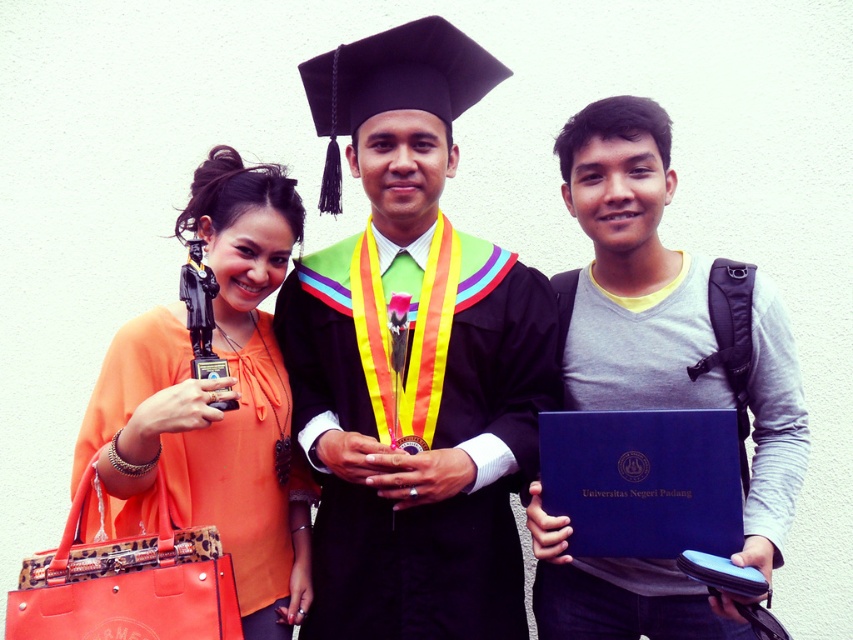
Does point (469, 564) come in front of point (299, 580)?

That is True.

Measure the distance between point [387,557] and camera.

They are 2.17 meters apart.

Find the location of `matte black graduation gown at center`. matte black graduation gown at center is located at coordinates (413, 358).

Does gray matte backpack at center have a smaller size compared to orange fabric purse at left?

No.

Which is behind, point (659, 381) or point (119, 333)?

Positioned behind is point (659, 381).

This screenshot has width=853, height=640. What are the coordinates of `gray matte backpack at center` in the screenshot? It's located at (631, 272).

This screenshot has width=853, height=640. Find the location of `gray matte backpack at center`. gray matte backpack at center is located at coordinates (631, 272).

Who is taller, matte black graduation gown at center or gray matte backpack at center?

matte black graduation gown at center is taller.

Between matte black graduation gown at center and gray matte backpack at center, which one is positioned higher?

matte black graduation gown at center

Describe the element at coordinates (413, 358) in the screenshot. I see `matte black graduation gown at center` at that location.

Where is `matte black graduation gown at center`? matte black graduation gown at center is located at coordinates (413, 358).